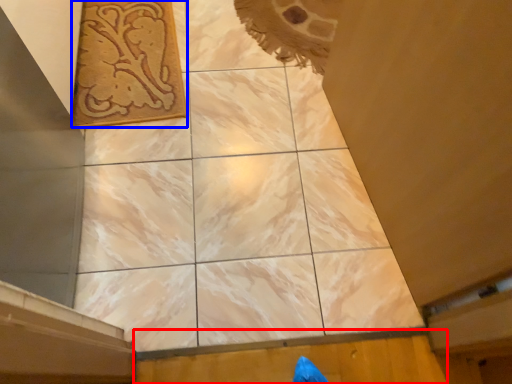
Question: Among these objects, which one is nearest to the camera, plywood (highlighted by a red box) or design (highlighted by a blue box)?

Choices:
 (A) plywood
 (B) design

Answer: (A)